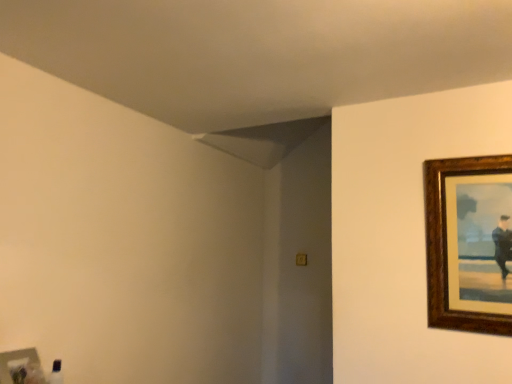
Describe the element at coordinates (469, 243) in the screenshot. This screenshot has width=512, height=384. I see `brown wooden picture frame at right` at that location.

This screenshot has width=512, height=384. In order to click on brown wooden picture frame at right in this screenshot , I will do pyautogui.click(x=469, y=243).

Locate an element on the screen. brown wooden picture frame at right is located at coordinates (469, 243).